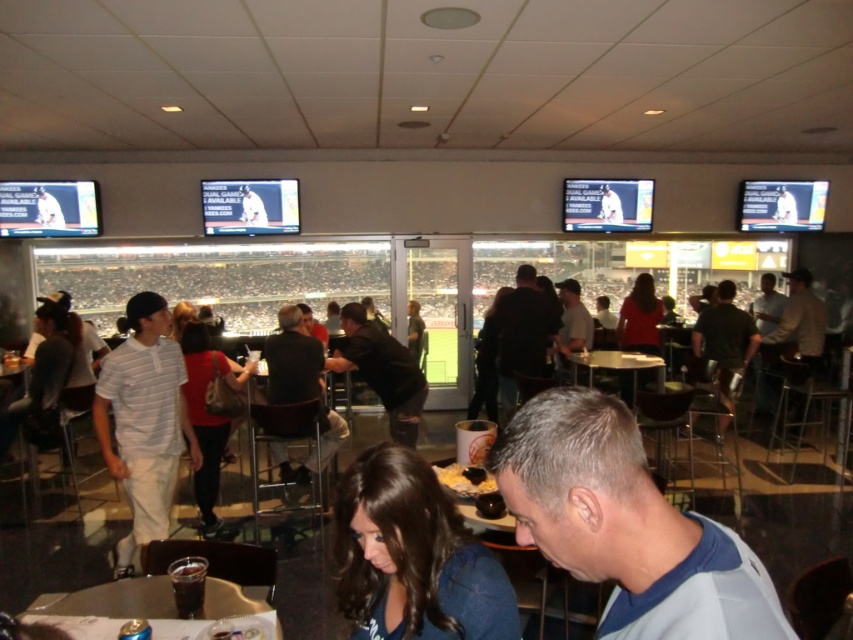
You are a photographer taking a picture of the dark blue sweater at lower center and the black matte shirt at center. Which object should you focus on first if you want to capture both in sharp focus?

The dark blue sweater at lower center is located below the black matte shirt at center. To capture both in sharp focus, you should focus on the black matte shirt at center first since it is closer to the camera, ensuring the sweater in the background remains in focus as well.

You are standing in the sports bar and want to move from point A to point B. Point A is at coordinate point (x=113, y=355) and point B is at coordinate point (x=364, y=362). Which point is closer to you when you first arrive?

Point A at coordinate point (x=113, y=355) is closer to you than point B at coordinate point (x=364, y=362) because it is nearer in the scene.